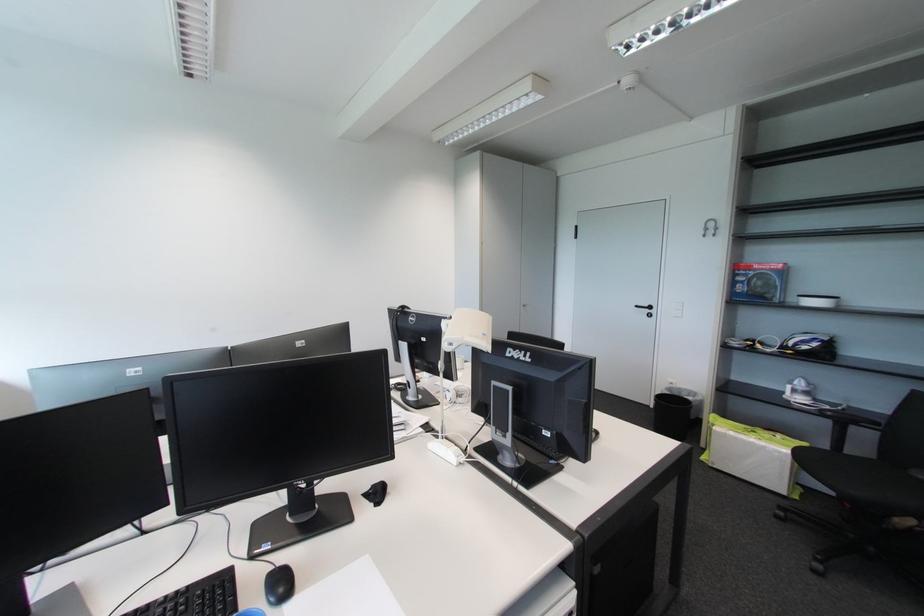
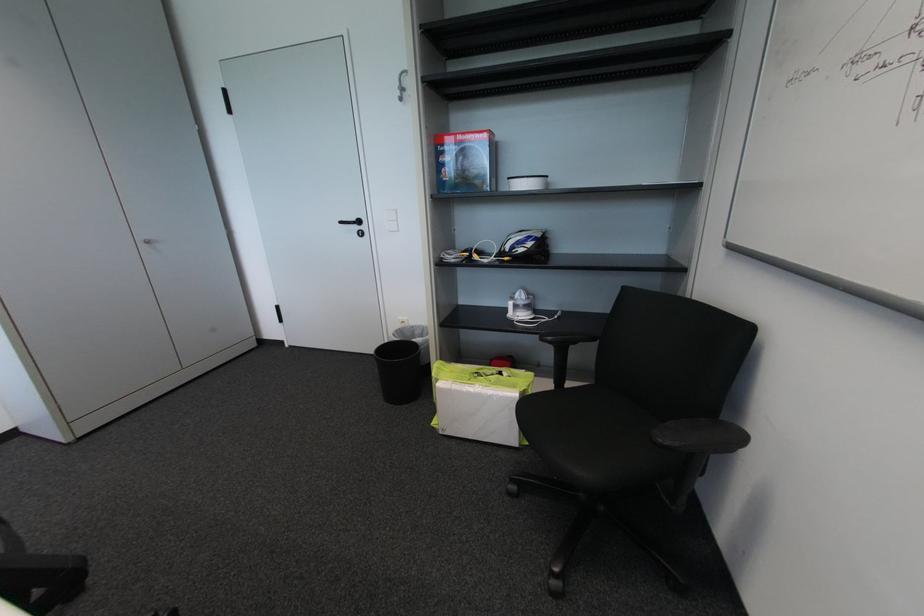
Where in the second image is the point corresponding to (x=762, y=268) from the first image?

(466, 139)